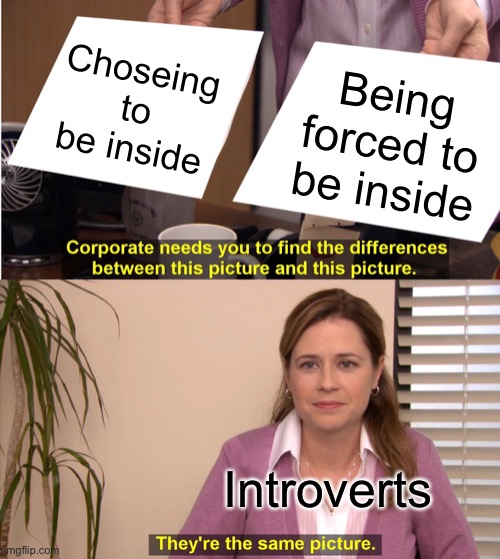
Locate an element on the screen. Image resolution: width=500 pixels, height=559 pixels. coffee mug is located at coordinates (205, 225).